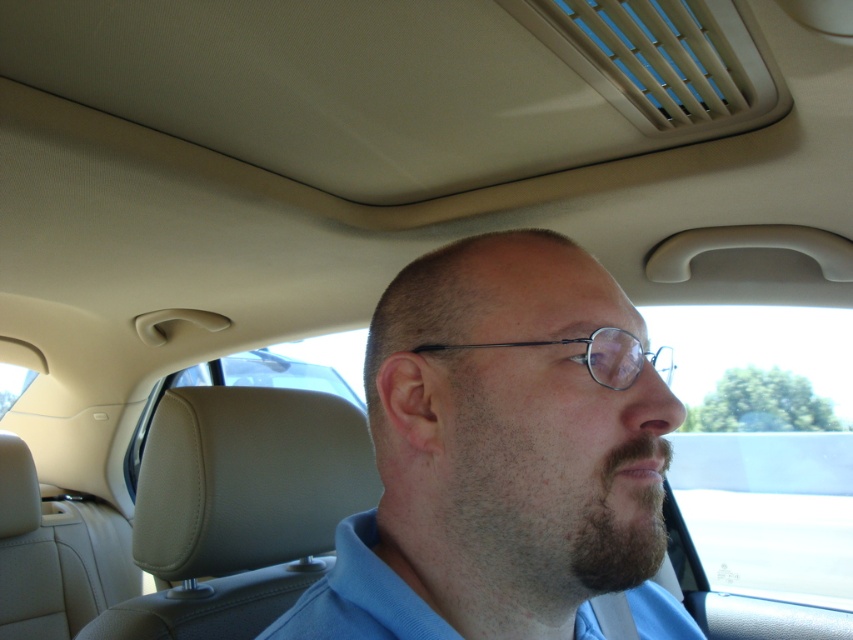
This screenshot has width=853, height=640. Describe the element at coordinates (502, 456) in the screenshot. I see `blue fabric shirt at center` at that location.

Is point (405, 573) positioned behind point (281, 614)?

That is False.

You are a GUI agent. You are given a task and a screenshot of the screen. Output one action in this format:
    pyautogui.click(x=<x>, y=<y>)
    Task: Click on the blue fabric shirt at center
    
    Given the screenshot: What is the action you would take?
    pyautogui.click(x=502, y=456)